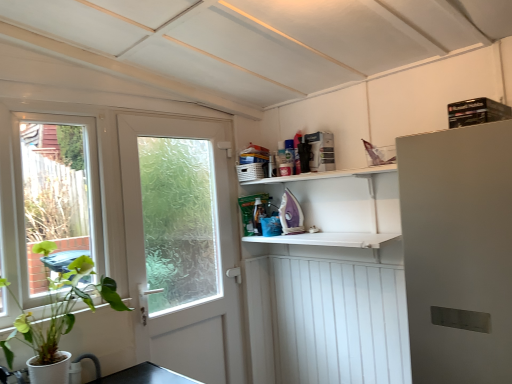
What do you see at coordinates (339, 322) in the screenshot? The height and width of the screenshot is (384, 512). I see `white wooden radiator at lower right` at bounding box center [339, 322].

In order to face white wooden radiator at lower right, should I rotate leftwards or rightwards?

To align with it, rotate right about 19.499°.

I want to click on white wooden radiator at lower right, so click(339, 322).

Measure the distance between point (135, 178) and camera.

Result: The depth of point (135, 178) is 7.65 feet.

What do you see at coordinates (185, 259) in the screenshot? I see `white matte door at left` at bounding box center [185, 259].

Locate an element on the screen. Image resolution: width=512 pixels, height=384 pixels. white matte door at left is located at coordinates (185, 259).

Image resolution: width=512 pixels, height=384 pixels. I want to click on white wooden radiator at lower right, so click(x=339, y=322).

Which is more to the right, white matte door at left or white wooden radiator at lower right?

From the viewer's perspective, white wooden radiator at lower right appears more on the right side.

Does white matte door at left come in front of white wooden radiator at lower right?

Yes.

Is point (223, 304) more distant than point (311, 290)?

Yes, point (223, 304) is farther from viewer.

From the image's perspective, is white matte door at left located beneath white wooden radiator at lower right?

No.

From a real-world perspective, is white matte door at left above or below white wooden radiator at lower right?

white matte door at left is above white wooden radiator at lower right.

Considering the relative sizes of white matte door at left and white wooden radiator at lower right in the image provided, is white matte door at left thinner than white wooden radiator at lower right?

Yes, white matte door at left is thinner than white wooden radiator at lower right.

Is white matte door at left shorter than white wooden radiator at lower right?

Yes, white matte door at left is shorter than white wooden radiator at lower right.

Is white matte door at left smaller than white wooden radiator at lower right?

Correct, white matte door at left occupies less space than white wooden radiator at lower right.

Would you say white matte door at left is inside or outside white wooden radiator at lower right?

white matte door at left is not inside white wooden radiator at lower right, it's outside.

Are white matte door at left and white wooden radiator at lower right located far from each other?

No, white matte door at left is not far from white wooden radiator at lower right.

Is white matte door at left facing towards white wooden radiator at lower right?

No, white matte door at left is not oriented towards white wooden radiator at lower right.

How many degrees apart are the facing directions of white matte door at left and white wooden radiator at lower right?

91 degrees.

Find the location of a particular element. The image size is (512, 384). door on the left side of white wooden radiator at lower right is located at coordinates (185, 259).

Considering the positions of objects white wooden radiator at lower right and white matte door at left in the image provided, who is more to the left, white wooden radiator at lower right or white matte door at left?

white matte door at left.

Is the depth of white wooden radiator at lower right greater than that of white matte door at left?

That is True.

Which point is more forward, (346, 328) or (223, 190)?

Positioned in front is point (346, 328).

Looking at this image, from the image's perspective, between white wooden radiator at lower right and white matte door at left, which one is located above?

white matte door at left is shown above in the image.

From a real-world perspective, does white wooden radiator at lower right sit lower than white matte door at left?

Correct, in the physical world, white wooden radiator at lower right is lower than white matte door at left.

Considering the sizes of objects white wooden radiator at lower right and white matte door at left in the image provided, who is thinner, white wooden radiator at lower right or white matte door at left?

white matte door at left is thinner.

Based on the photo, can you confirm if white wooden radiator at lower right is taller than white matte door at left?

Indeed, white wooden radiator at lower right has a greater height compared to white matte door at left.

Does white wooden radiator at lower right have a smaller size compared to white matte door at left?

Incorrect, white wooden radiator at lower right is not smaller in size than white matte door at left.

From the picture: Could white matte door at left be considered to be inside white wooden radiator at lower right?

No, white matte door at left is not a part of white wooden radiator at lower right.

Would you consider white wooden radiator at lower right to be distant from white matte door at left?

No, white wooden radiator at lower right is not far away from white matte door at left.

Is white wooden radiator at lower right oriented towards white matte door at left?

No, white wooden radiator at lower right is not facing towards white matte door at left.

What's the angular difference between white wooden radiator at lower right and white matte door at left's facing directions?

The angle between the facing direction of white wooden radiator at lower right and the facing direction of white matte door at left is 91 degrees.

How far apart are white wooden radiator at lower right and white matte door at left?

63.35 centimeters.

Where is `screen door beneath the white matte door at left (from a real-world perspective)`? This screenshot has height=384, width=512. screen door beneath the white matte door at left (from a real-world perspective) is located at coordinates (339, 322).

In order to click on screen door located behind the white matte door at left in this screenshot , I will do `click(339, 322)`.

I want to click on door above the white wooden radiator at lower right (from the image's perspective), so click(185, 259).